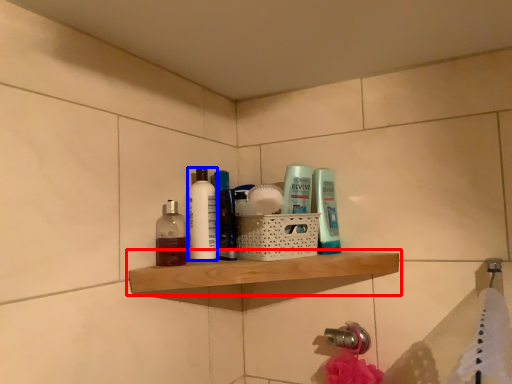
Question: Among these objects, which one is nearest to the camera, shelf (highlighted by a red box) or toiletry (highlighted by a blue box)?

Choices:
 (A) shelf
 (B) toiletry

Answer: (A)